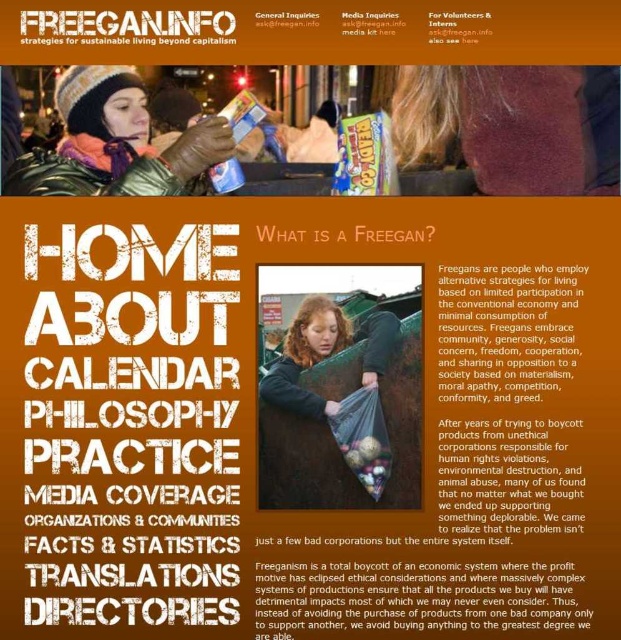
Does white paper text at center appear over white paper at upper center?

No.

Does white paper text at center lie in front of white paper at upper center?

Yes, it is.

I want to click on white paper text at center, so click(x=130, y=385).

Does point (386, 33) come in front of point (288, 24)?

No.

Who is positioned more to the right, white paper media kit at upper center or white paper at upper center?

From the viewer's perspective, white paper media kit at upper center appears more on the right side.

Who is more forward, [392,35] or [310,22]?

Point [310,22]

This screenshot has width=621, height=640. Identify the location of white paper media kit at upper center. click(369, 22).

Can you confirm if matte orange text at upper right is bigger than white paper at upper center?

Indeed, matte orange text at upper right has a larger size compared to white paper at upper center.

Is matte orange text at upper right smaller than white paper at upper center?

Actually, matte orange text at upper right might be larger than white paper at upper center.

Locate an element on the screen. The width and height of the screenshot is (621, 640). matte orange text at upper right is located at coordinates (458, 26).

Locate an element on the screen. Image resolution: width=621 pixels, height=640 pixels. matte orange text at upper right is located at coordinates (458, 26).